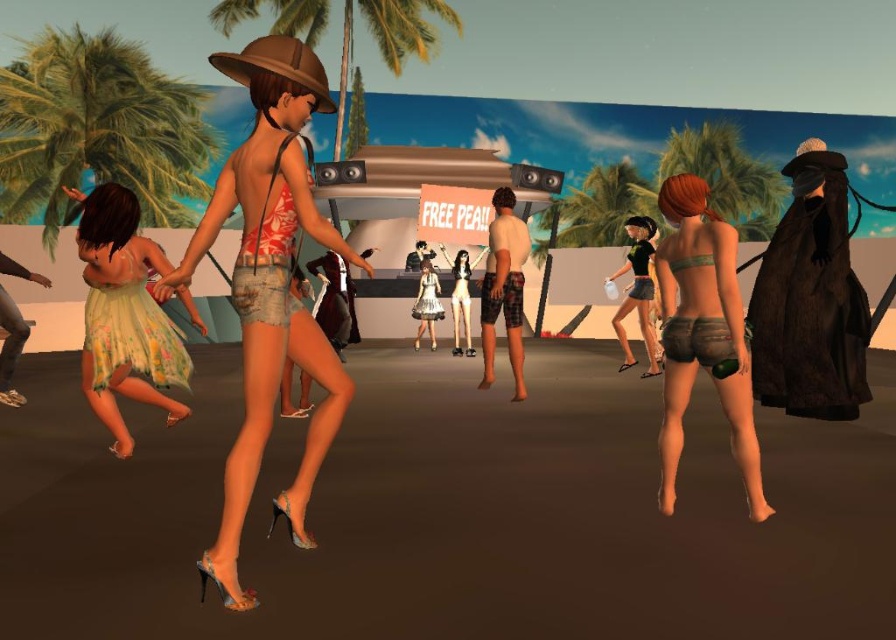
Does shiny metallic shorts at center appear under green leafy palm tree at upper center?

Indeed, shiny metallic shorts at center is positioned under green leafy palm tree at upper center.

Locate an element on the screen. shiny metallic shorts at center is located at coordinates (269, 285).

Which is below, brown leather shorts at right or matte black shorts at center?

brown leather shorts at right is lower down.

Measure the distance between brown leather shorts at right and matte black shorts at center.

brown leather shorts at right and matte black shorts at center are 4.17 meters apart from each other.

The height and width of the screenshot is (640, 896). Describe the element at coordinates (702, 332) in the screenshot. I see `brown leather shorts at right` at that location.

This screenshot has width=896, height=640. I want to click on brown leather shorts at right, so click(702, 332).

Does green leafy palm tree at left have a lesser width compared to brown leather shorts at right?

Yes, green leafy palm tree at left is thinner than brown leather shorts at right.

Is point (16, 83) positioned after point (747, 492)?

Yes.

What do you see at coordinates (97, 131) in the screenshot?
I see `green leafy palm tree at left` at bounding box center [97, 131].

Locate an element on the screen. The height and width of the screenshot is (640, 896). green leafy palm tree at left is located at coordinates (97, 131).